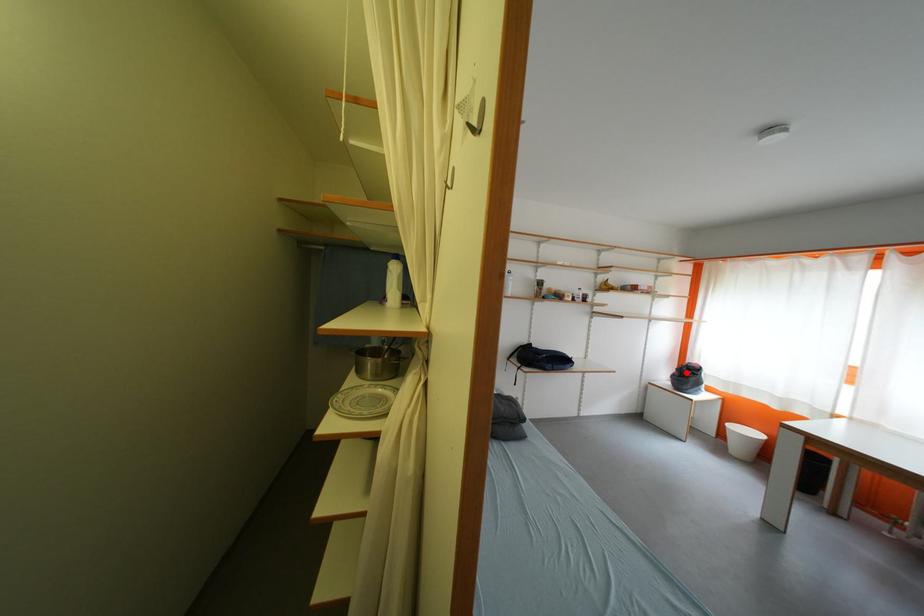
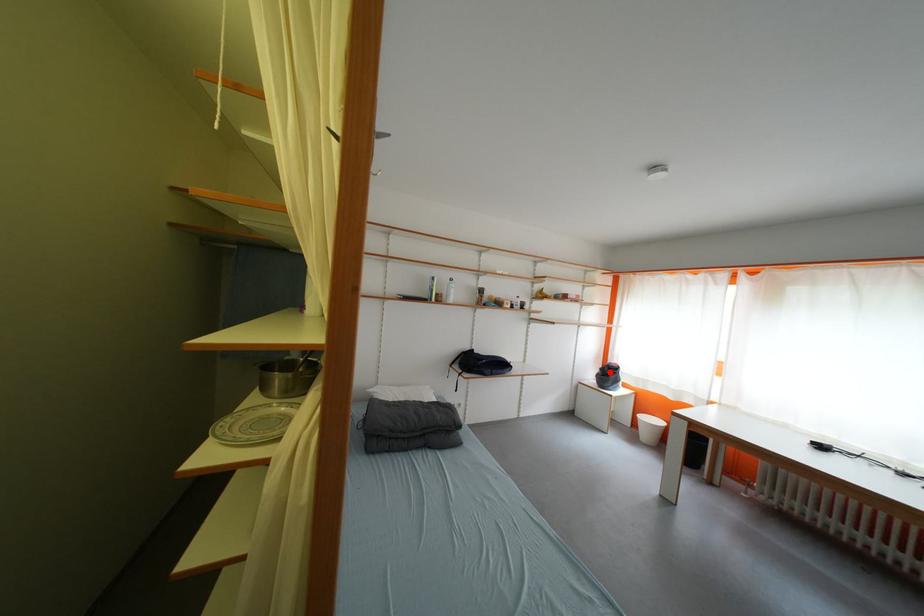
I am providing you with two images of the same scene from different viewpoints. A red point is marked on the first image and another point is marked on the second image. Does the point marked in image1 correspond to the same location as the one in image2?

Yes